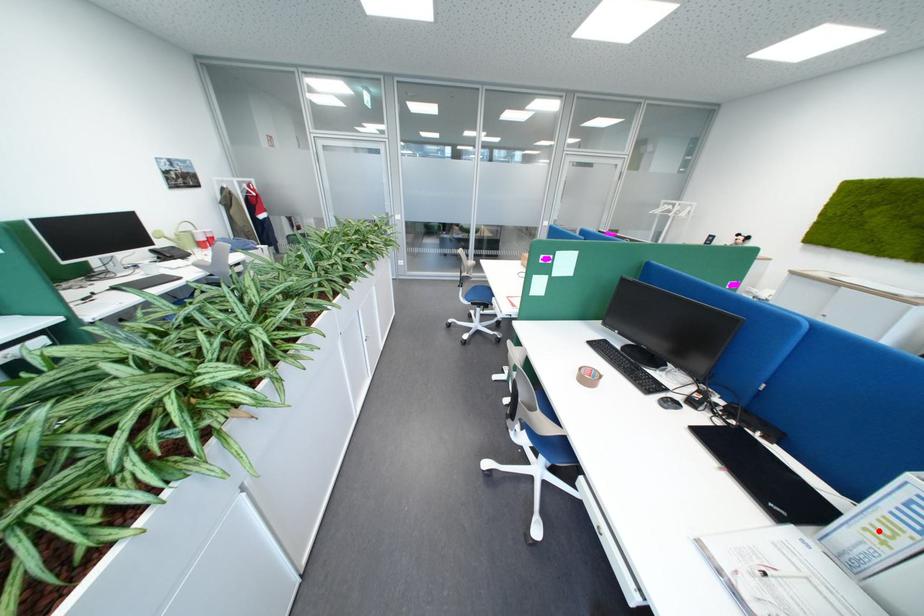
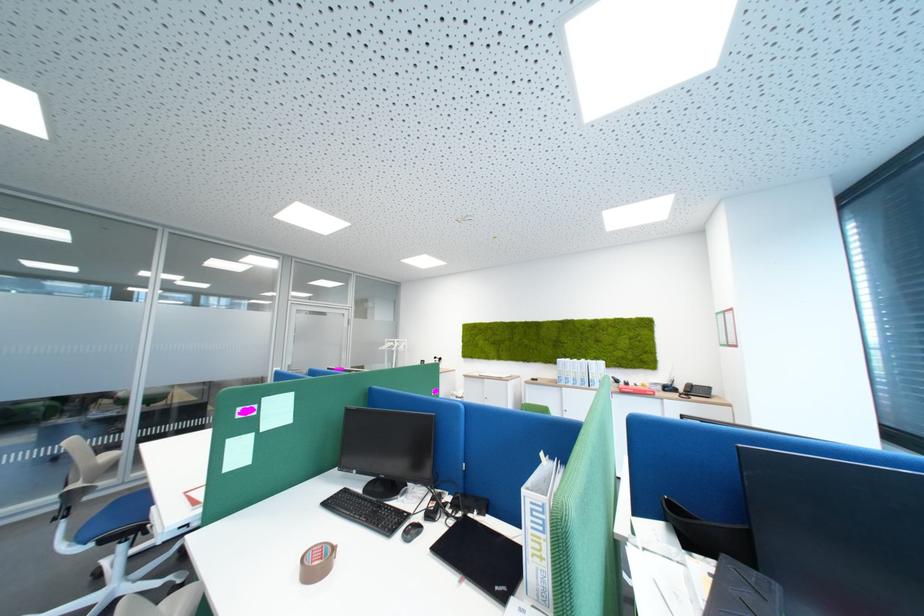
The point at the highlighted location is marked in the first image. Where is the corresponding point in the second image?

(545, 556)